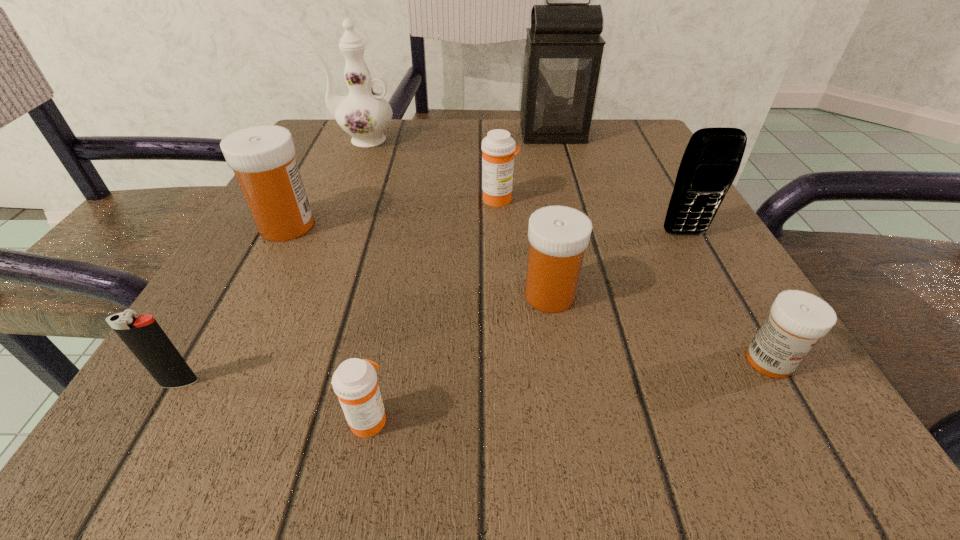
The width and height of the screenshot is (960, 540). Identify the location of vacant point located between the tallest medicine and the cellular telephone. click(x=486, y=230).

The height and width of the screenshot is (540, 960). In order to click on free space between the eighth shortest object and the tallest object in this screenshot , I will do `click(457, 137)`.

Locate an element on the screen. Image resolution: width=960 pixels, height=540 pixels. unoccupied position between the nearest medicine and the second tallest object is located at coordinates (365, 279).

Locate which object ranks fourth in proximity to the gray lantern. Please provide its 2D coordinates. Your answer should be formatted as a tuple, i.e. [(x, y)], where the tuple contains the x and y coordinates of a point satisfying the conditions above.

[(558, 235)]

The height and width of the screenshot is (540, 960). Identify the location of object that is the fourth closest to the chinaware. (558, 235).

Where is `the closest medicine to the igniter`? This screenshot has height=540, width=960. the closest medicine to the igniter is located at coordinates (354, 382).

Identify the location of medicine identified as the closest to the second nearest medicine. This screenshot has width=960, height=540. (558, 235).

Locate which white medicine ranks second in proximity to the cellular telephone. Please provide its 2D coordinates. Your answer should be formatted as a tuple, i.e. [(x, y)], where the tuple contains the x and y coordinates of a point satisfying the conditions above.

[(797, 320)]

Locate an element on the screen. white medicine that stands as the third closest to the eighth shortest object is located at coordinates (797, 320).

The image size is (960, 540). Find the location of `free spot that satisfies the following two spatial constraints: 1. at the spout of the farthest medicine; 2. on the right side of the eighth shortest object`. free spot that satisfies the following two spatial constraints: 1. at the spout of the farthest medicine; 2. on the right side of the eighth shortest object is located at coordinates (336, 199).